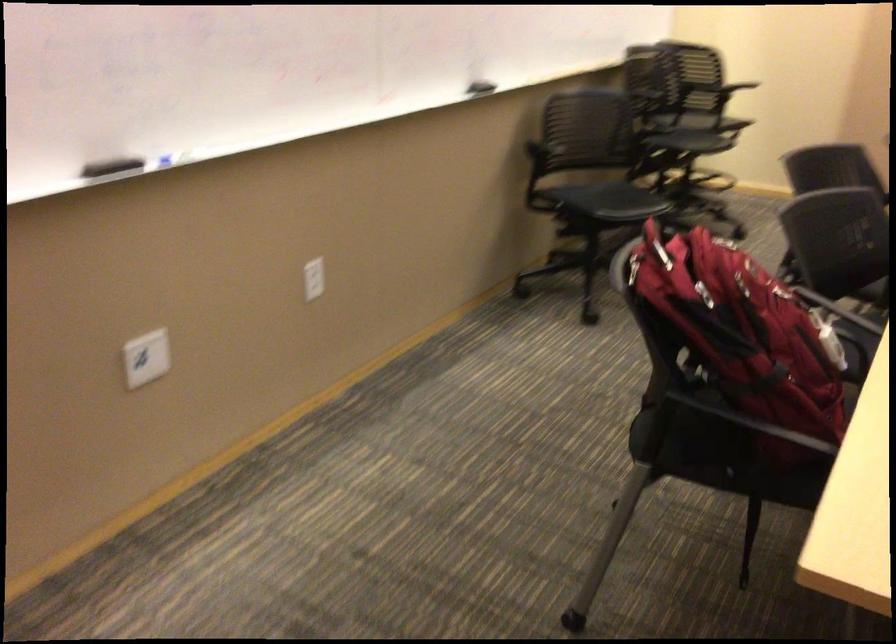
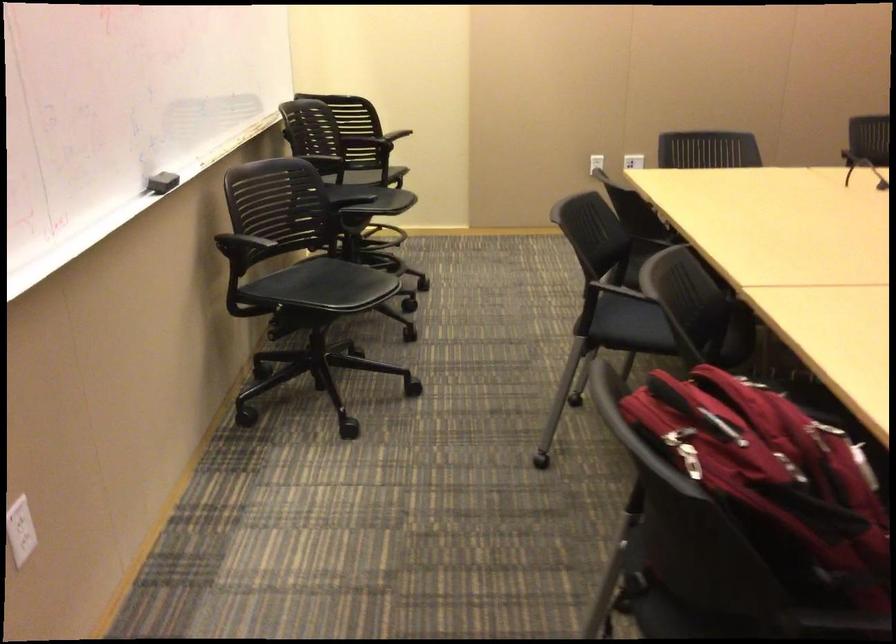
Question: The camera is either moving clockwise (left) or counter-clockwise (right) around the object. The first image is from the beginning of the video and the second image is from the end. Is the camera moving left or right when shooting the video?

Choices:
 (A) Left
 (B) Right

Answer: (A)